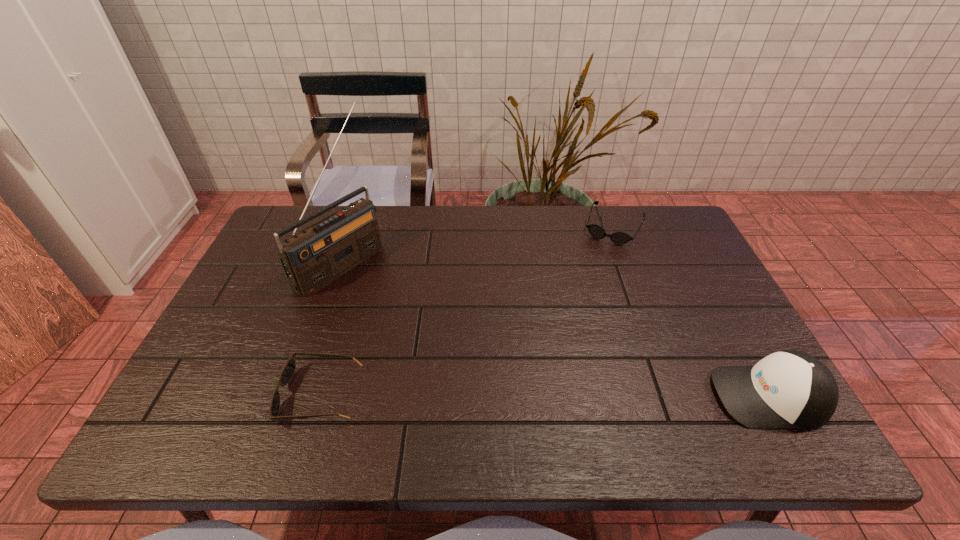
Where is `object located at the left edge`? object located at the left edge is located at coordinates (314, 257).

The height and width of the screenshot is (540, 960). I want to click on cap at the right edge, so click(x=789, y=389).

Locate an element on the screen. The height and width of the screenshot is (540, 960). sunglasses located at the right edge is located at coordinates (619, 237).

At what (x,y) coordinates should I click in order to perform the action: click on object located in the far left corner section of the desktop. Please return your answer as a coordinate pair (x, y). This screenshot has width=960, height=540. Looking at the image, I should click on (314, 257).

Where is `object that is at the far right corner`? This screenshot has height=540, width=960. object that is at the far right corner is located at coordinates (619, 237).

Image resolution: width=960 pixels, height=540 pixels. Identify the location of object present at the near right corner. (789, 389).

In the image, there is a desktop. Identify the location of vacant space at the far edge. The width and height of the screenshot is (960, 540). (479, 208).

Locate an element on the screen. vacant space at the near edge of the desktop is located at coordinates (562, 395).

This screenshot has height=540, width=960. Find the location of `vacant space at the left edge of the desktop`. vacant space at the left edge of the desktop is located at coordinates (276, 261).

The width and height of the screenshot is (960, 540). In the image, there is a desktop. In order to click on free space at the right edge in this screenshot , I will do `click(684, 303)`.